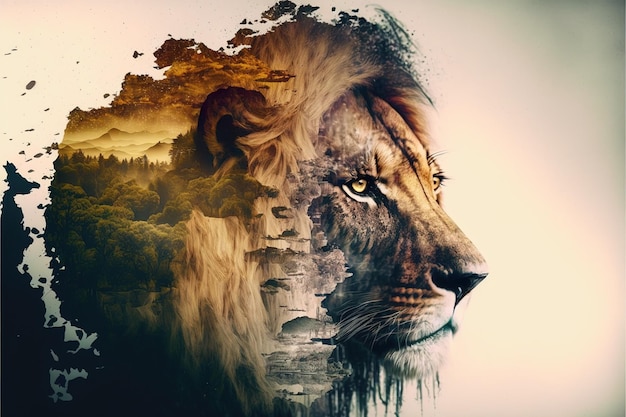
I want to click on painting, so click(x=340, y=240).